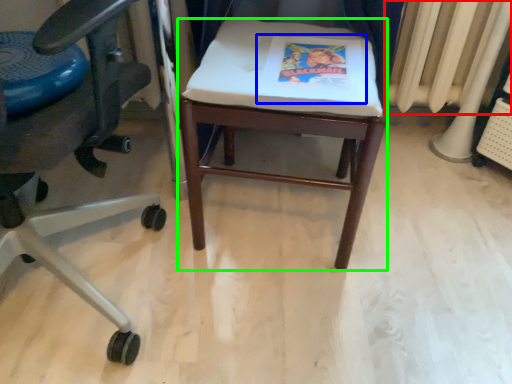
Question: Which object is the farthest from radiator (highlighted by a red box)? Choose among these: paperback book (highlighted by a blue box) or stool (highlighted by a green box).

Choices:
 (A) paperback book
 (B) stool

Answer: (A)